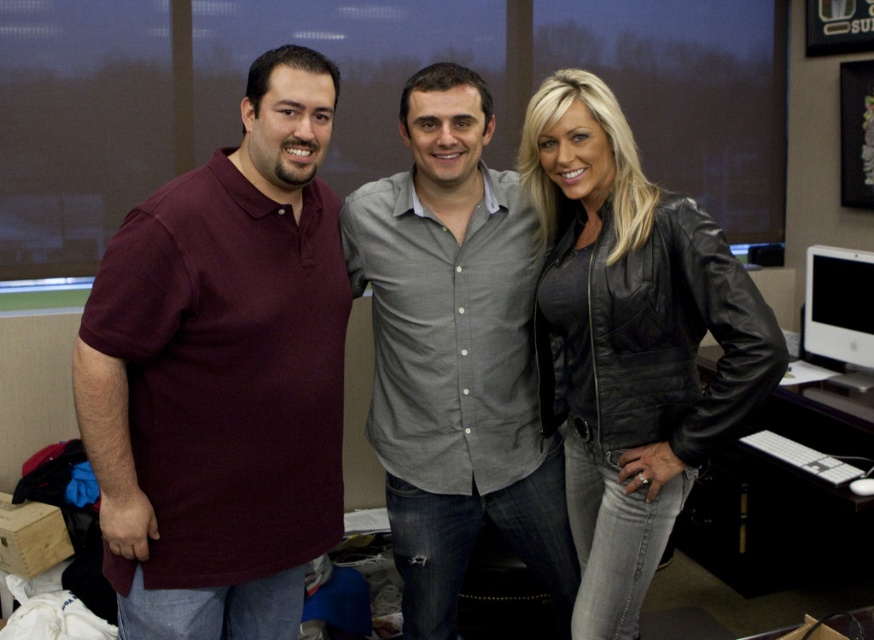
You are standing in an office with three people. There is a black leather jacket at center. Where is the black leather jacket located in relation to the other people?

The black leather jacket at center is located at point [630,340], which places it centrally in the image between the three individuals.

You are organizing a small event and need to place a large poster on the wall behind the black leather jacket at center and the white glossy monitor at right. Which object should you position the poster closer to if you want it to cover more of the wall space?

The black leather jacket at center is bigger than the white glossy monitor at right, so positioning the poster closer to the black leather jacket at center would allow it to cover more wall space.